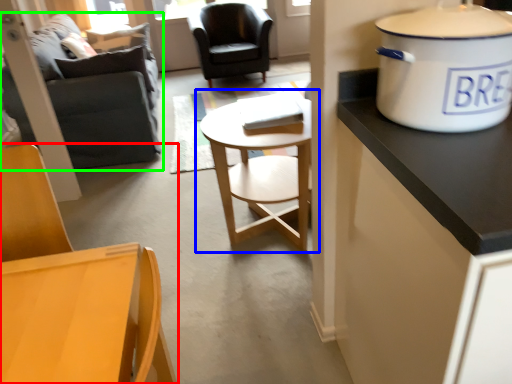
Question: Which object is the farthest from chair (highlighted by a red box)? Choose among these: coffee table (highlighted by a blue box) or studio couch (highlighted by a green box).

Choices:
 (A) coffee table
 (B) studio couch

Answer: (B)